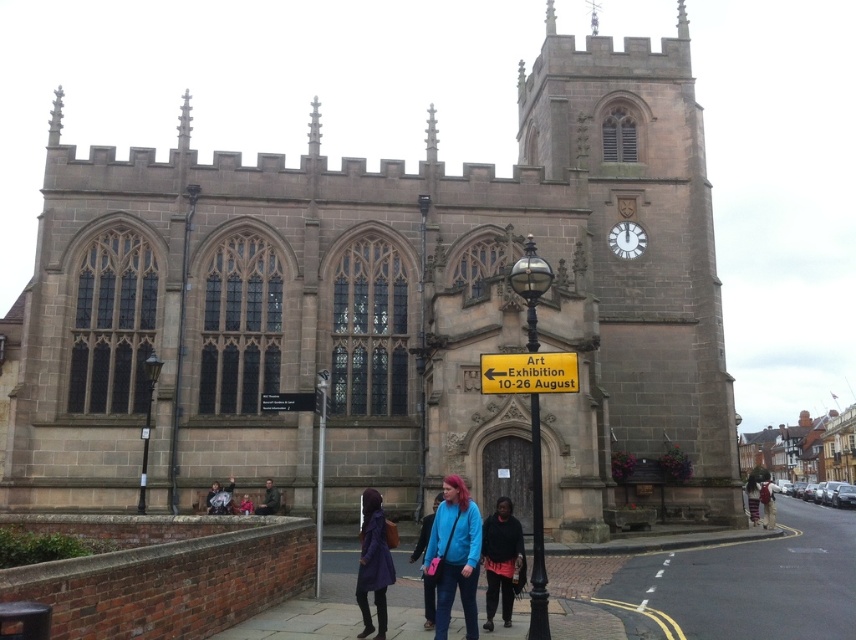
Question: Among these objects, which one is nearest to the camera?

Choices:
 (A) brown stone clock tower at center
 (B) dark blue jacket at center

Answer: (A)

Question: Can you confirm if brown stone clock tower at center is bigger than blue fabric jacket at center?

Choices:
 (A) no
 (B) yes

Answer: (B)

Question: Is blue fabric jacket at center below dark blue jacket at center?

Choices:
 (A) no
 (B) yes

Answer: (A)

Question: Is smooth concrete pavement at lower right in front of dark blue sweater at center?

Choices:
 (A) no
 (B) yes

Answer: (B)

Question: Considering the real-world distances, which object is farthest from the dark purple fabric coat at lower center?

Choices:
 (A) brown stone church at center
 (B) dark brown leather jacket at lower center

Answer: (A)

Question: Which of the following is the farthest from the observer?

Choices:
 (A) blue fabric jacket at center
 (B) smooth concrete pavement at lower right
 (C) dark brown leather jacket at lower center

Answer: (C)